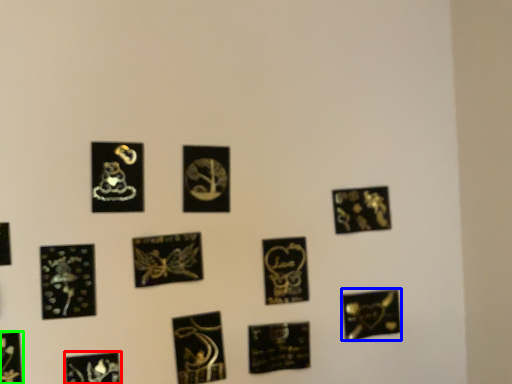
Question: Based on their relative distances, which object is nearer to picture frame (highlighted by a red box)? Choose from picture frame (highlighted by a blue box) and picture frame (highlighted by a green box).

Choices:
 (A) picture frame
 (B) picture frame

Answer: (B)